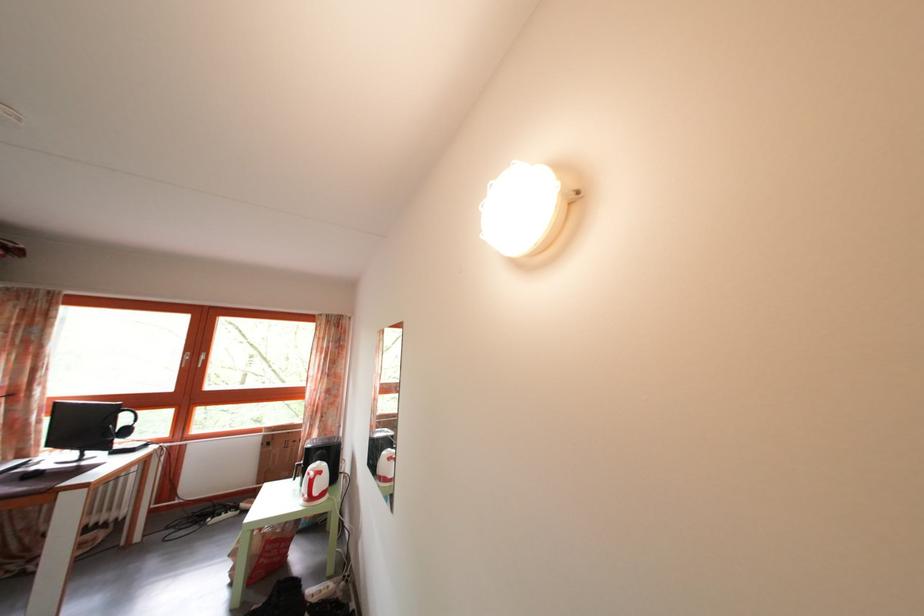
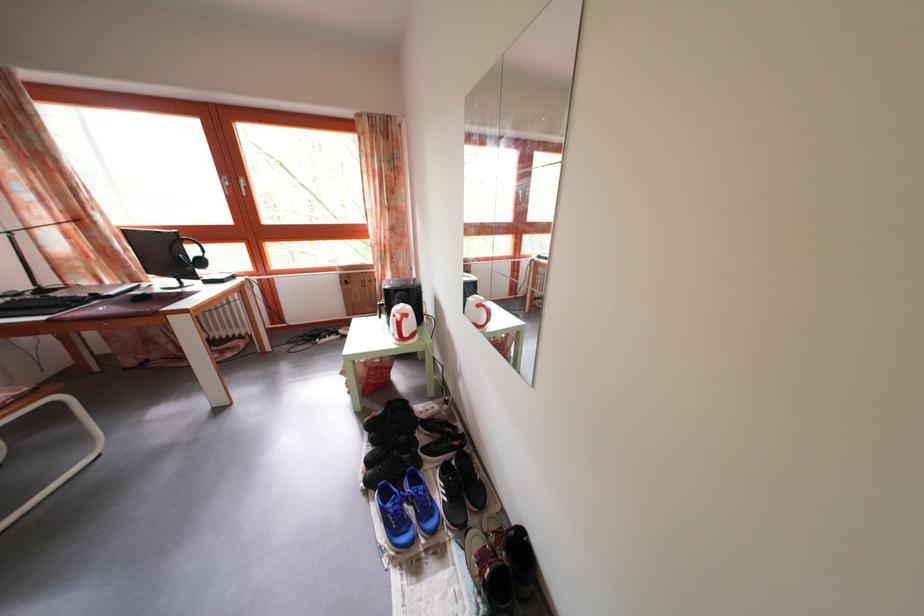
Find the pixel in the second image that matches (128,451) in the first image.

(213, 281)